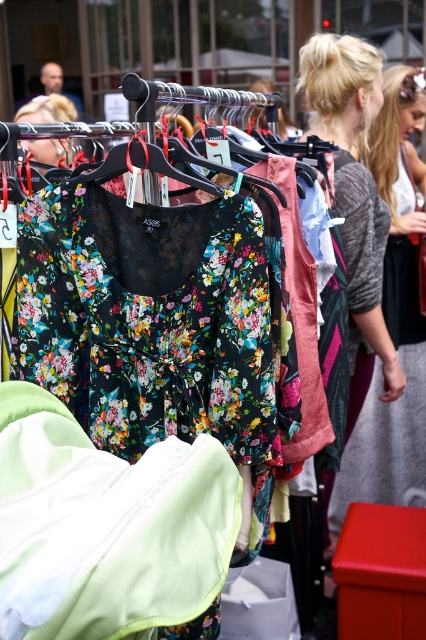
Between light green fabric at lower left and gray knit sweater at center, which one appears on the right side from the viewer's perspective?

Positioned to the right is gray knit sweater at center.

Is light green fabric at lower left bigger than gray knit sweater at center?

No.

Which is in front, point (51, 612) or point (399, 317)?

Point (51, 612) is more forward.

Find the location of a particular element. The image size is (426, 640). light green fabric at lower left is located at coordinates (106, 525).